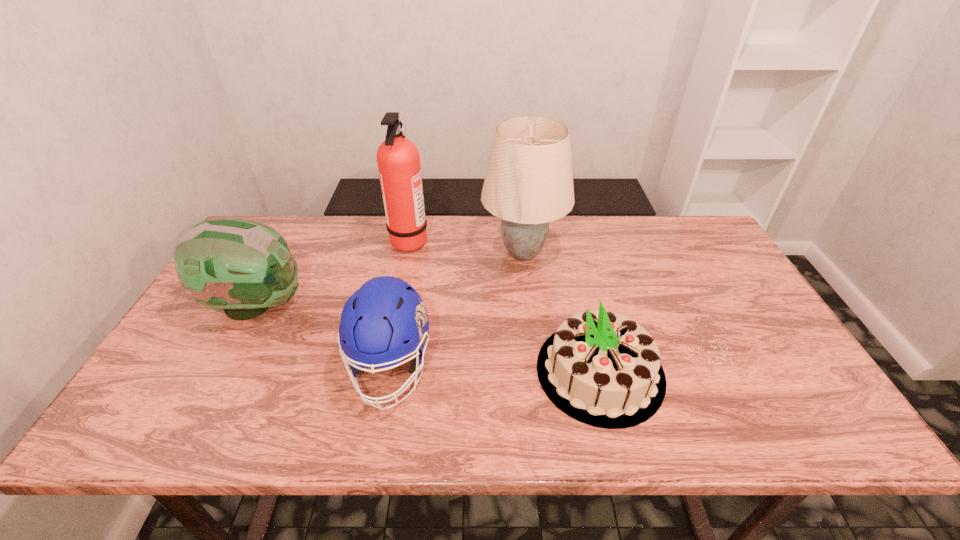
In order to click on free space between the fire extinguisher and the lampshade in this screenshot , I will do `click(467, 246)`.

Find the location of a particular element. The image size is (960, 540). vacant point located between the lampshade and the shortest object is located at coordinates click(x=562, y=312).

Image resolution: width=960 pixels, height=540 pixels. I want to click on free point between the leftmost object and the fire extinguisher, so click(333, 273).

Where is `vacant space in between the lampshade and the right football helmet`? vacant space in between the lampshade and the right football helmet is located at coordinates click(x=457, y=310).

Locate an element on the screen. vacant area that lies between the left football helmet and the right football helmet is located at coordinates (324, 336).

The height and width of the screenshot is (540, 960). Identify the location of free space between the birthday cake and the lampshade. (562, 312).

At what (x,y) coordinates should I click in order to perform the action: click on free space between the right football helmet and the birthday cake. Please return your answer as a coordinate pair (x, y). Image resolution: width=960 pixels, height=540 pixels. Looking at the image, I should click on (495, 370).

This screenshot has height=540, width=960. Identify the location of object that ranks as the third closest to the fire extinguisher. 385,321.

In order to click on the closest object to the right football helmet in this screenshot , I will do `click(244, 267)`.

I want to click on vacant space that satisfies the following two spatial constraints: 1. on the front side of the lampshade; 2. on the left side of the birthday cake, so click(x=538, y=372).